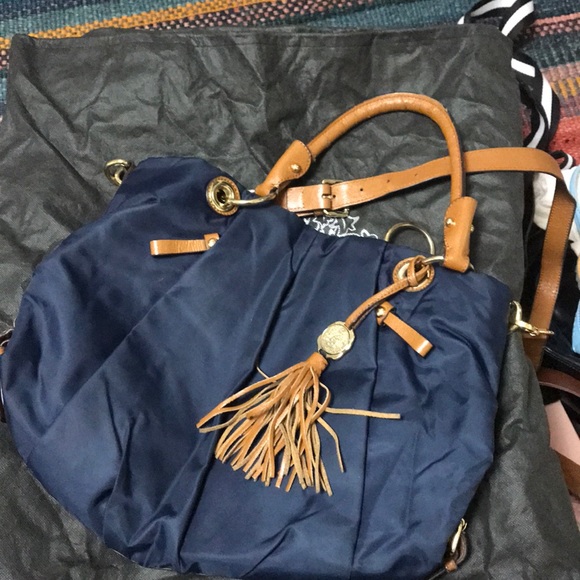
At what (x,y) coordinates should I click in order to perform the action: click on grommet. Please return your answer as a coordinate pair (x, y). The image size is (580, 580). Looking at the image, I should click on (119, 166), (216, 198), (398, 271).